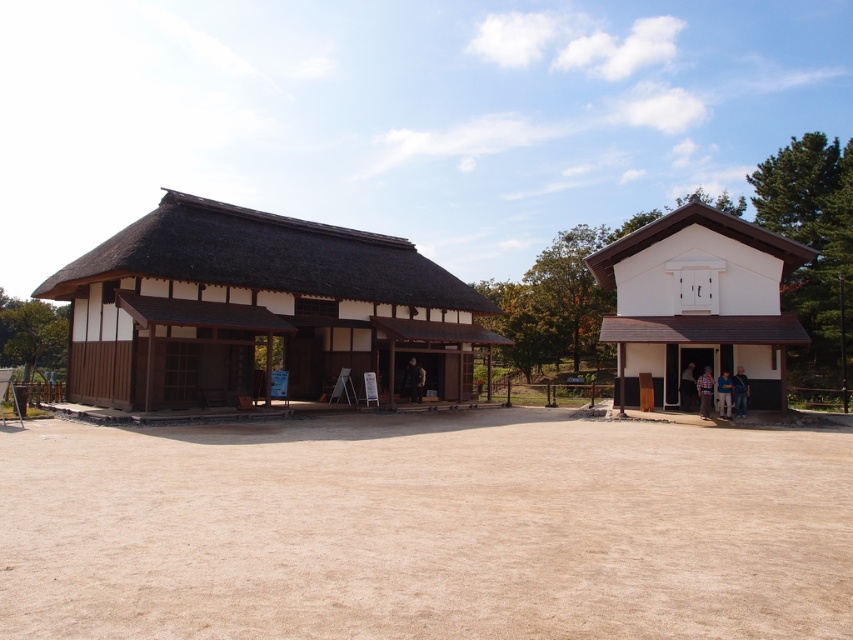
Does brown sandy dirt field at center come in front of wooden thatched roof hut at center?

Yes, brown sandy dirt field at center is in front of wooden thatched roof hut at center.

Identify the location of brown sandy dirt field at center. (425, 529).

Is brown sandy dirt field at center to the right of white matte house at right from the viewer's perspective?

No, brown sandy dirt field at center is not to the right of white matte house at right.

Find the location of `brown sandy dirt field at center`. brown sandy dirt field at center is located at coordinates (425, 529).

Locate an element on the screen. The image size is (853, 640). brown sandy dirt field at center is located at coordinates (425, 529).

Identify the location of brown sandy dirt field at center. (425, 529).

From the picture: Does wooden thatched roof hut at center appear over white matte house at right?

Indeed, wooden thatched roof hut at center is positioned over white matte house at right.

Find the location of a particular element. The width and height of the screenshot is (853, 640). wooden thatched roof hut at center is located at coordinates (254, 307).

Is point (200, 369) positioned behind point (759, 308)?

That is False.

This screenshot has width=853, height=640. Find the location of `wooden thatched roof hut at center`. wooden thatched roof hut at center is located at coordinates (254, 307).